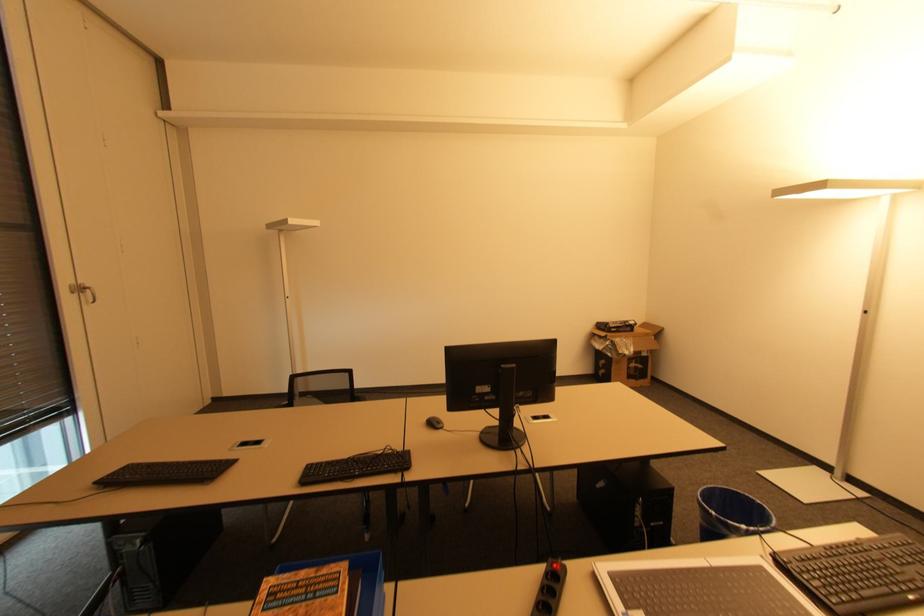
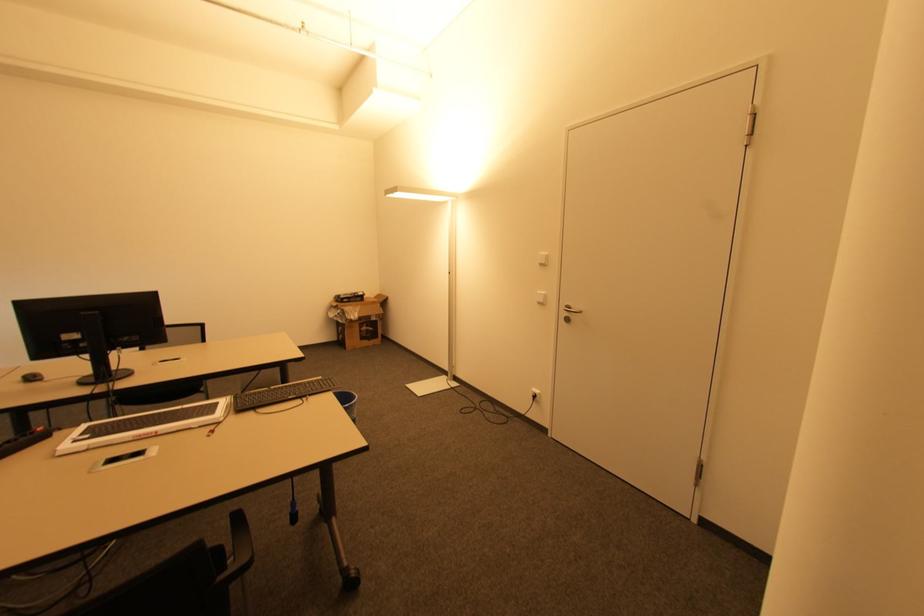
Find the pixel in the second image that matches point (427, 422) in the first image.

(21, 379)